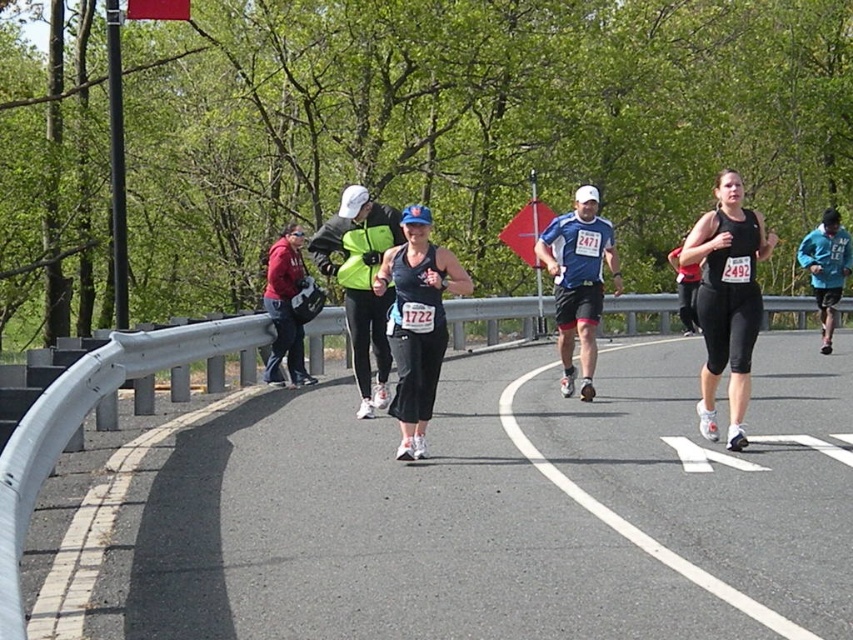
Question: Observing the image, what is the correct spatial positioning of blue fabric shirt at center in reference to matte red jacket at left?

Choices:
 (A) below
 (B) above

Answer: (B)

Question: Can you confirm if black matte running outfit at center is thinner than blue fabric shirt at center?

Choices:
 (A) yes
 (B) no

Answer: (B)

Question: Does blue fabric shirt at center have a greater width compared to matte red jacket at left?

Choices:
 (A) yes
 (B) no

Answer: (A)

Question: Which point is closer to the camera taking this photo?

Choices:
 (A) (732, 179)
 (B) (270, 301)
 (C) (567, 227)

Answer: (A)

Question: Which point is closer to the camera?

Choices:
 (A) matte black tank top at center
 (B) black matte running outfit at center
 (C) matte red jacket at left
 (D) blue fabric shirt at center

Answer: (A)

Question: Estimate the real-world distances between objects in this image. Which object is closer to the matte black tank top at center?

Choices:
 (A) matte red jacket at left
 (B) black matte running outfit at center

Answer: (B)